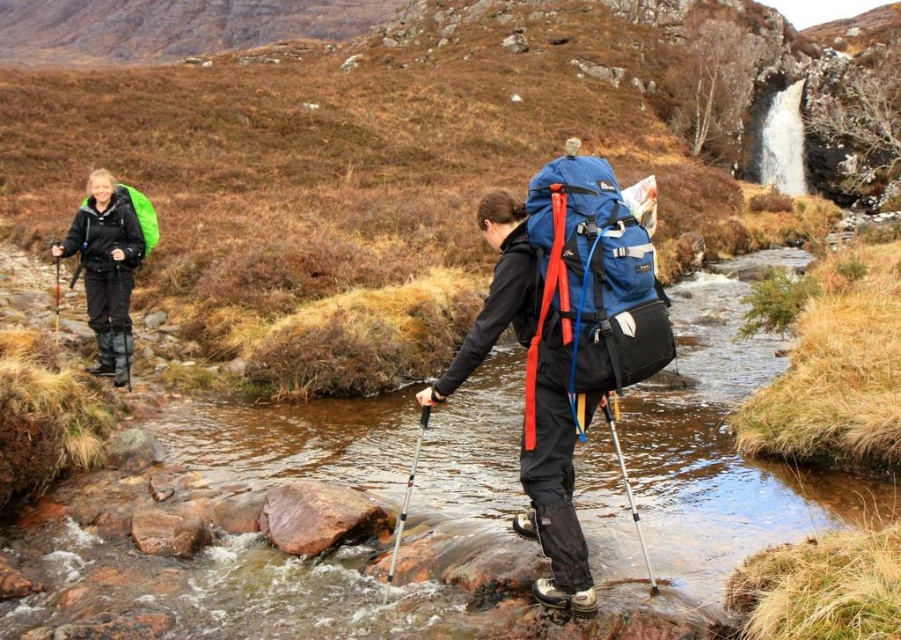
Find the location of a particular element. This screenshot has height=640, width=901. brown rocky creek at center is located at coordinates (705, 461).

Can you confirm if brown rocky creek at center is wider than blue fabric backpack at center?

Yes, brown rocky creek at center is wider than blue fabric backpack at center.

Which is behind, point (704, 285) or point (588, 292)?

The point (704, 285) is more distant.

In order to click on brown rocky creek at center in this screenshot , I will do `click(705, 461)`.

Can you confirm if matte blue backpack at center is bigger than matte black jacket at left?

No.

In the scene shown: Can you confirm if matte blue backpack at center is shorter than matte black jacket at left?

Yes, matte blue backpack at center is shorter than matte black jacket at left.

Which is behind, point (572, 483) or point (114, 384)?

The point (114, 384) is more distant.

Identify the location of matte blue backpack at center. The width and height of the screenshot is (901, 640). (554, 506).

Can you confirm if matte blue backpack at center is bigger than green matte backpack at left?

No, matte blue backpack at center is not bigger than green matte backpack at left.

Does matte blue backpack at center appear on the left side of green matte backpack at left?

No, matte blue backpack at center is not to the left of green matte backpack at left.

Does point (557, 467) come farther from viewer compared to point (149, 216)?

No.

Locate an element on the screen. matte blue backpack at center is located at coordinates (554, 506).